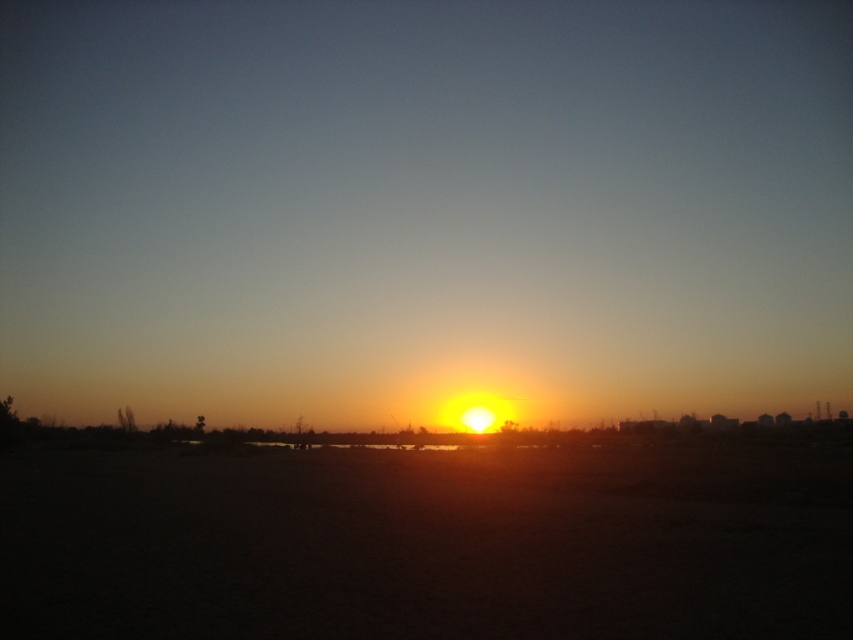
Question: Is yellow-orange sky at center bigger than smooth sand beach at center?

Choices:
 (A) yes
 (B) no

Answer: (A)

Question: Does yellow-orange sky at center have a larger size compared to smooth sand beach at center?

Choices:
 (A) no
 (B) yes

Answer: (B)

Question: Which point is farther from the camera taking this photo?

Choices:
 (A) (672, 595)
 (B) (94, 280)

Answer: (B)

Question: Is yellow-orange sky at center to the right of smooth sand beach at center from the viewer's perspective?

Choices:
 (A) no
 (B) yes

Answer: (A)